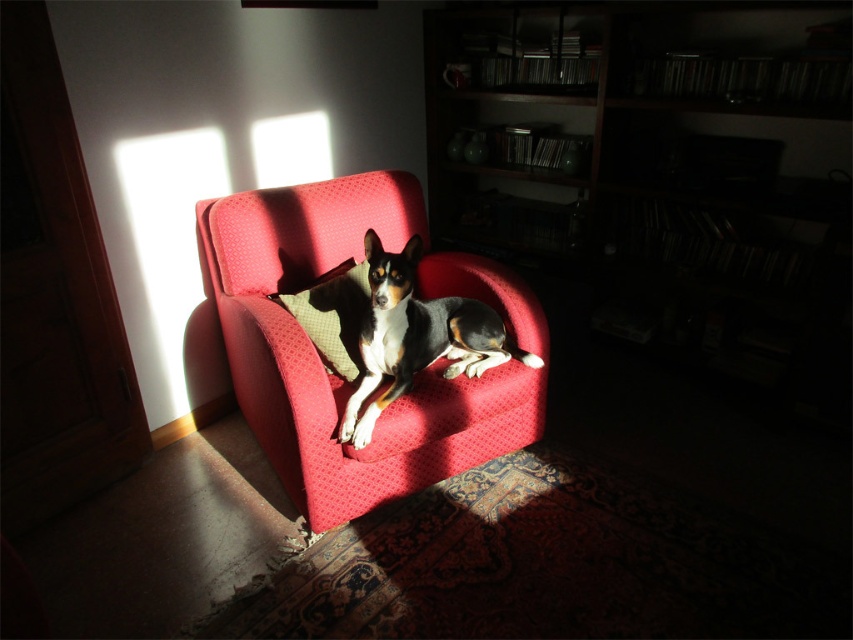
You are a photographer setting up a tripod to capture the black and white fur dog at center. The tripod requires a minimum of 0.3 meters of space around it to avoid obstruction. Given the dog is at position coordinates of 0.525, 0.490, will the tripod fit in the scene without overlapping the dog?

The black and white fur dog at center is positioned at coordinates [416,336]. The tripod requires 0.3 meters of space around it. Since the coordinates are relative and the required space is absolute, the answer depends on the actual dimensions of the scene. However, based on the provided information, there is no indication of spatial constraints preventing the tripod placement. Therefore, the tripod can likely be positioned without overlapping the dog.

You are standing in the room and want to sit on the velvet red armchair at center. Based on the coordinates provided, can you determine if the point marked at (323, 365) is the correct location to sit on the velvet red armchair at center?

The point marked at (323, 365) corresponds to the velvet red armchair at center, so yes, that is the correct location to sit on the velvet red armchair at center.

You are a photographer setting up a shoot in the room. You want to ensure the black and white fur dog at center and the green textured pillow at center are both visible in the frame. Given their sizes, which object requires a wider angle to capture fully?

The black and white fur dog at center requires a wider angle to capture fully because its width surpasses that of the green textured pillow at center.